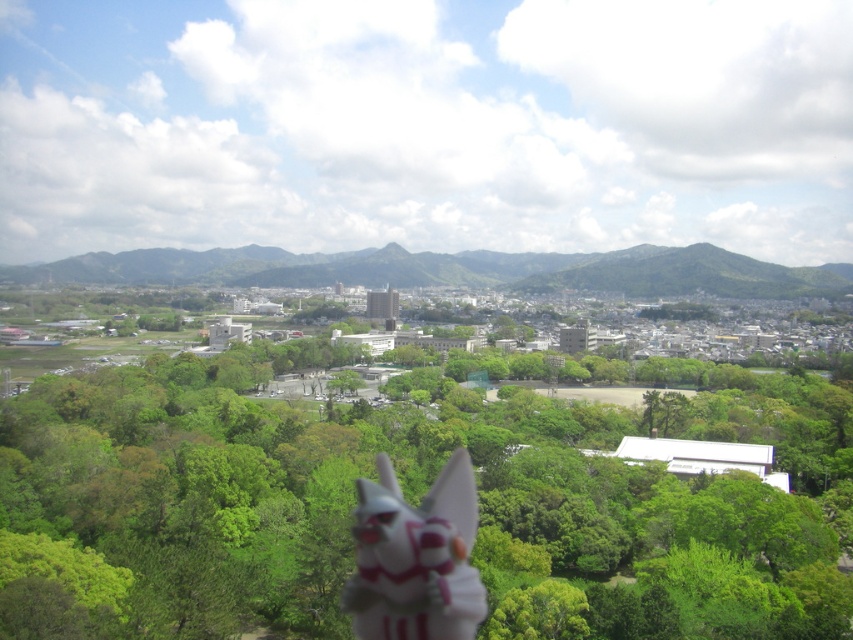
You are a photographer trying to capture both the green leafy tree at center and the white glossy fox at lower center in a single shot. Based on their sizes, which object will appear bigger in your photo?

The green leafy tree at center will appear bigger in the photo because it is larger in size than the white glossy fox at lower center.

You are a photographer standing in the landscape and want to take a photo of the white glossy fox at lower center and the green leafy tree at center. Which object should you adjust your camera to focus on first if you want to capture both in the same frame?

The green leafy tree at center is positioned on the left side of the white glossy fox at lower center, so you should focus on the green leafy tree at center first to ensure both are in the frame.

You are a photographer aiming to capture the white glossy fox at lower center and the green leafy tree at center in the same frame. Based on their sizes in the image, which object would appear taller in the photo?

The green leafy tree at center appears taller in the photo because it has a greater height compared to the white glossy fox at lower center.